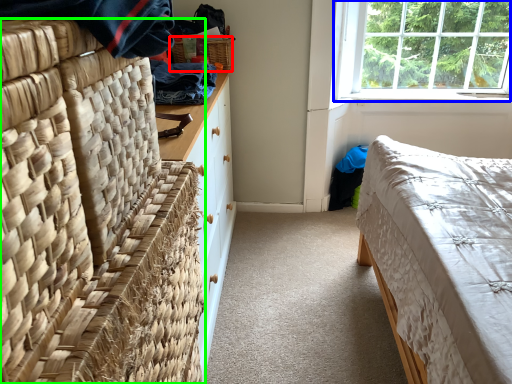
Question: Estimate the real-world distances between objects in this image. Which object is farther from picnic basket (highlighted by a red box), window (highlighted by a blue box) or furniture (highlighted by a green box)?

Choices:
 (A) window
 (B) furniture

Answer: (B)